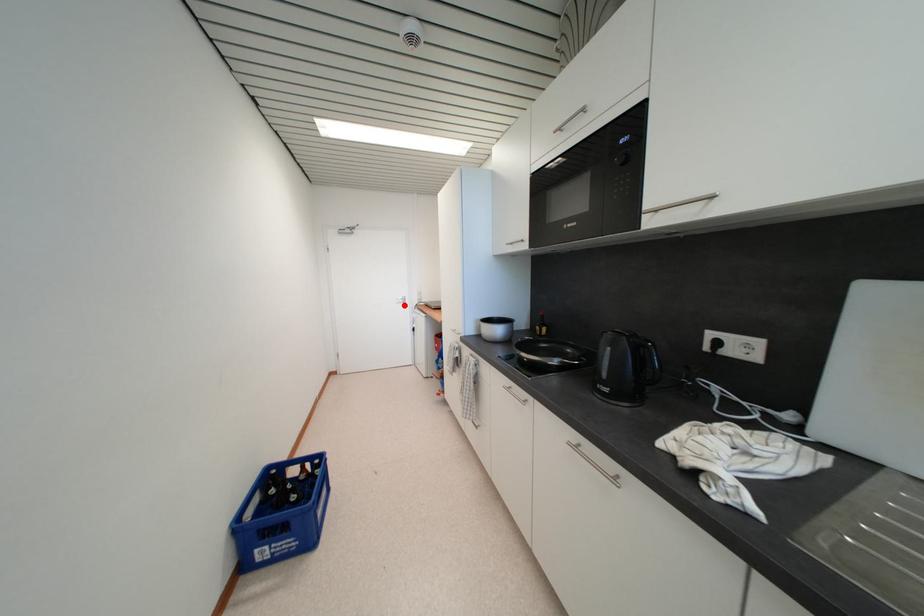
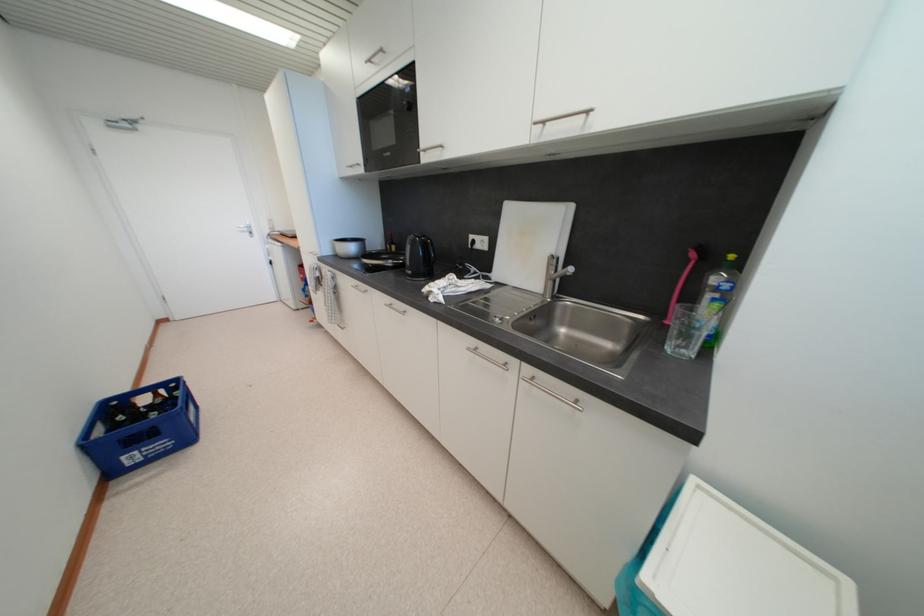
In the second image, find the point that corresponds to the highlighted location in the first image.

(248, 235)